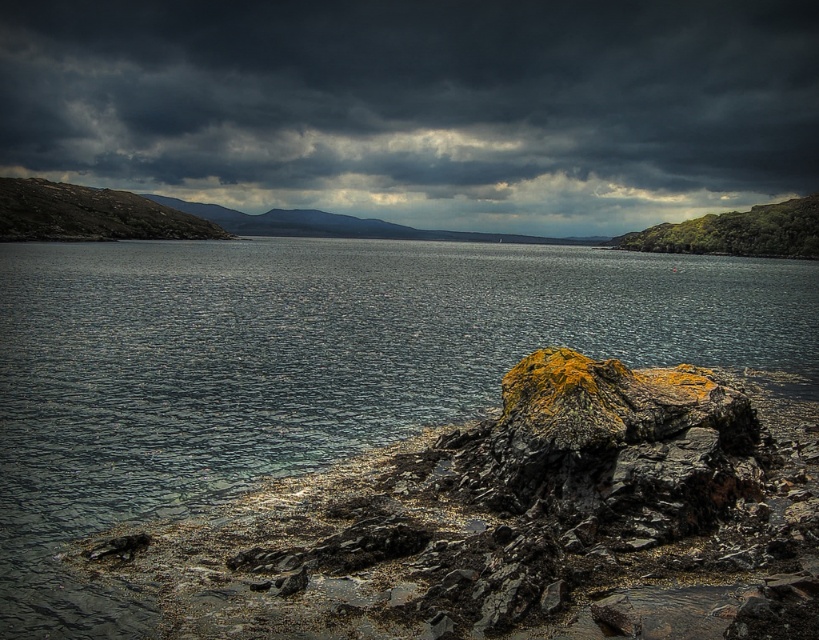
Does dark gray cloud at upper center have a greater width compared to dark gray water at center?

Correct, the width of dark gray cloud at upper center exceeds that of dark gray water at center.

From the picture: Is dark gray cloud at upper center taller than dark gray water at center?

Yes, dark gray cloud at upper center is taller than dark gray water at center.

You are a GUI agent. You are given a task and a screenshot of the screen. Output one action in this format:
    pyautogui.click(x=<x>, y=<y>)
    Task: Click on the dark gray cloud at upper center
    
    Given the screenshot: What is the action you would take?
    pyautogui.click(x=419, y=106)